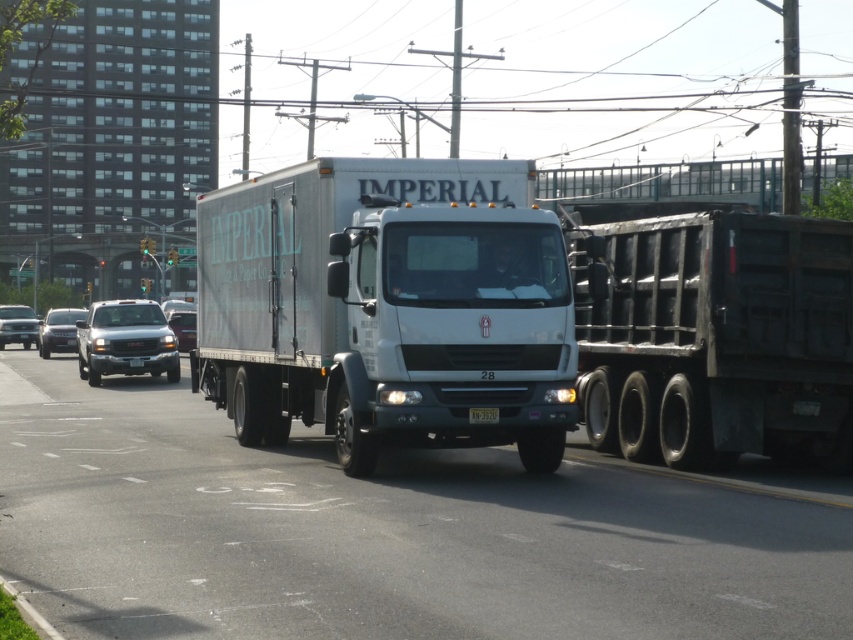
You are a pedestrian standing at the edge of the road. You see a matte silver sedan at center and a satin black sedan at center. Which one is closer to your left side?

The matte silver sedan at center is to the left of the satin black sedan at center, so it is closer to your left side.

You are a pedestrian standing on the sidewalk and see the white matte truck at center and the black plastic license plate at center. Which object is closer to the left side of the road?

The white matte truck at center is closer to the left side of the road because it is positioned to the left of the black plastic license plate at center.